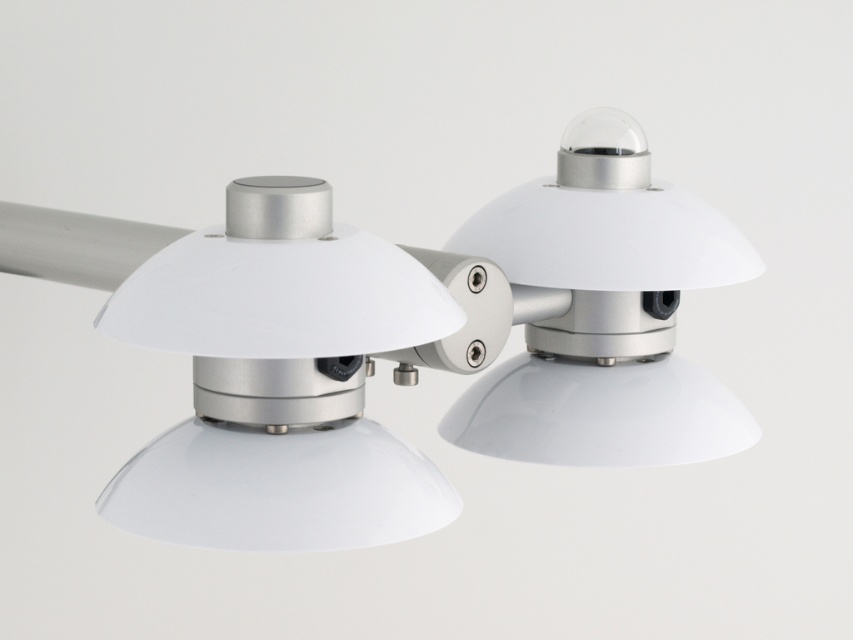
Which of these two, white matte lampshade at center or white glossy dome at upper right, stands taller?

white glossy dome at upper right is taller.

Does white matte lampshade at center have a greater height compared to white glossy dome at upper right?

In fact, white matte lampshade at center may be shorter than white glossy dome at upper right.

Is point (120, 250) farther from viewer compared to point (691, 417)?

That is False.

The width and height of the screenshot is (853, 640). In order to click on white matte lampshade at center in this screenshot , I will do `click(273, 364)`.